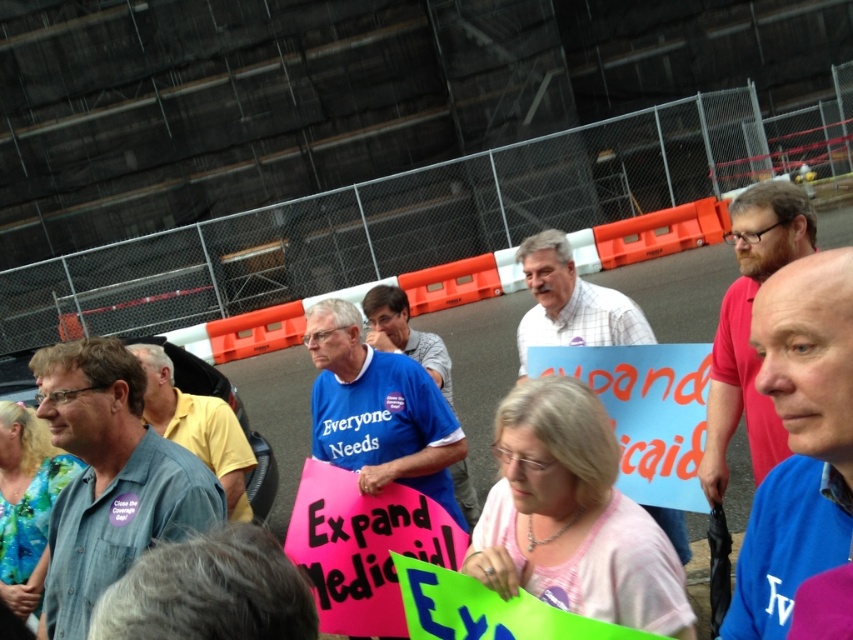
Question: Is plaid shirt at center above blue shirt at center?

Choices:
 (A) no
 (B) yes

Answer: (B)

Question: Which object is closer to the camera taking this photo?

Choices:
 (A) white checkered shirt at center
 (B) bearded man at center
 (C) blue shirt at center
 (D) plaid shirt at center

Answer: (B)

Question: Is blue fabric shirt at center wider than plaid shirt at center?

Choices:
 (A) no
 (B) yes

Answer: (A)

Question: Which object is the farthest from the blue fabric shirt at center?

Choices:
 (A) white checkered shirt at center
 (B) plaid shirt at center
 (C) bearded man at center

Answer: (A)

Question: Does blue fabric shirt at center have a greater width compared to white checkered shirt at center?

Choices:
 (A) yes
 (B) no

Answer: (B)

Question: Which point is farther to the camera?

Choices:
 (A) blue shirt at center
 (B) blue fabric shirt at center
 (C) bearded man at center

Answer: (A)